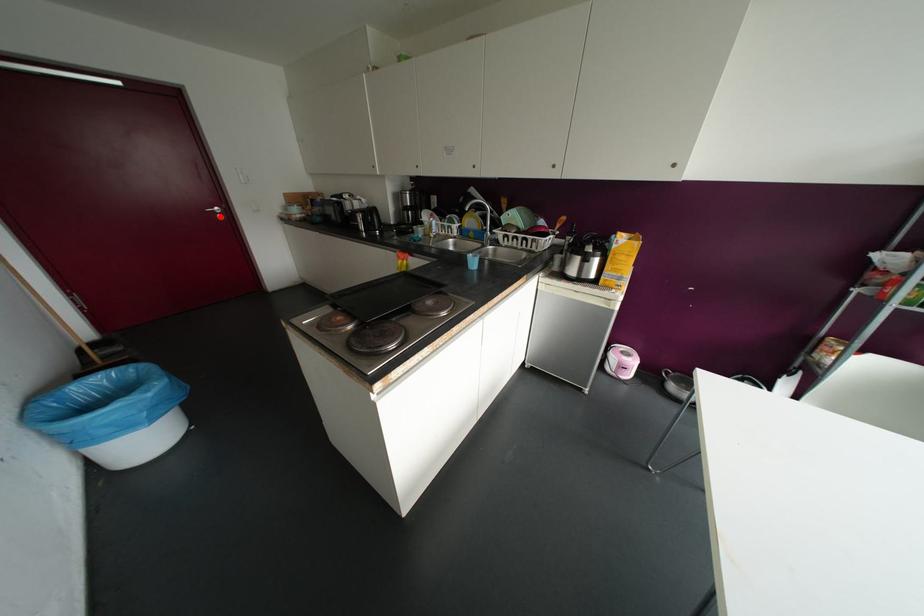
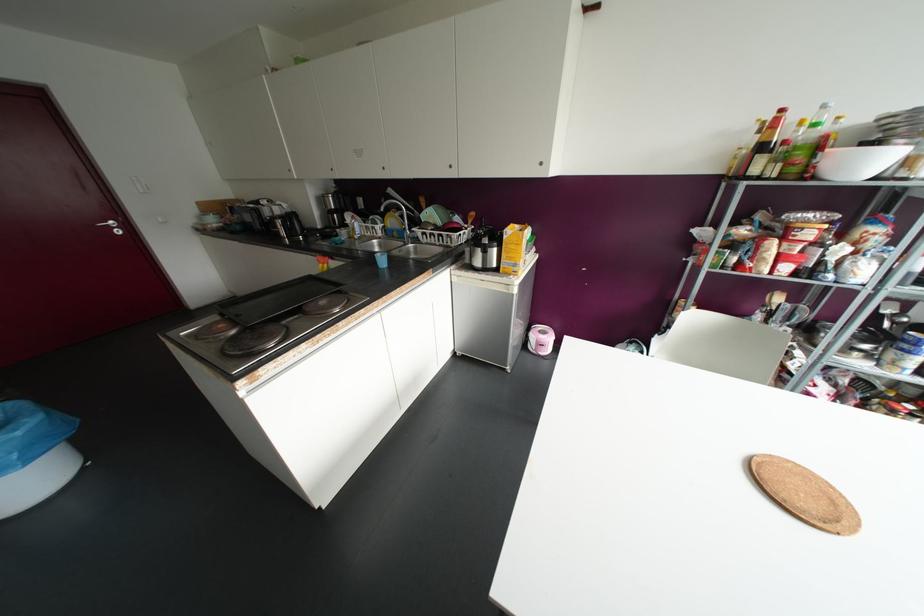
Find the pixel in the second image that matches the highlighted location in the first image.

(117, 232)